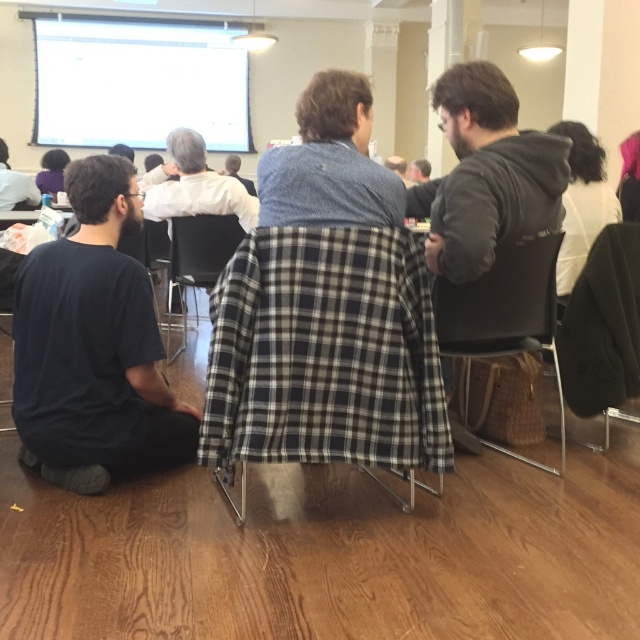
You are a photographer trying to capture a candid shot of the smooth gray sweater at center without the subject noticing. Since the black plaid fabric at center is in the way, can you adjust your angle to see the sweater?

The black plaid fabric at center is below the smooth gray sweater at center, so yes, you can adjust your angle to see the sweater above the fabric.

Based on the photo, you are standing in the conference room and want to place a small plant pot at the point marked as point (262, 356). If the plant pot requires 2 meters of space from the camera to avoid blocking the view, will placing it there be okay?

The distance of point (262, 356) from the camera is 1.94 meters, which is less than the required 2 meters. Placing the plant pot there may block the view.